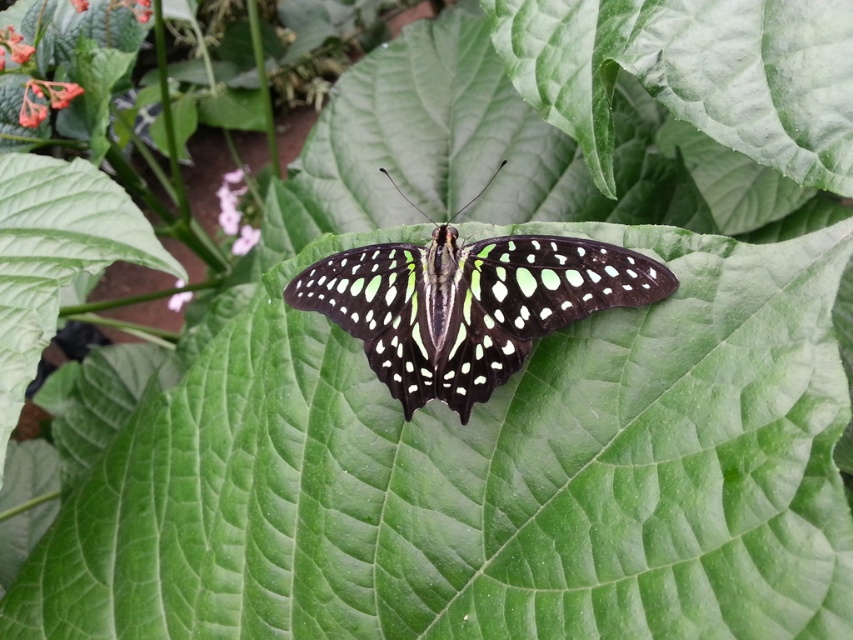
Question: Does green glossy butterfly at center appear on the right side of pink matte flower at center?

Choices:
 (A) no
 (B) yes

Answer: (B)

Question: From the image, what is the correct spatial relationship of pink matte flower at center in relation to pink matte flower at lower left?

Choices:
 (A) above
 (B) below

Answer: (A)

Question: Which point is farther to the camera?

Choices:
 (A) (254, 234)
 (B) (405, 394)
 (C) (257, 209)

Answer: (C)

Question: Which point is farther to the camera?

Choices:
 (A) pyautogui.click(x=178, y=291)
 (B) pyautogui.click(x=238, y=252)
 (C) pyautogui.click(x=368, y=316)
 (D) pyautogui.click(x=256, y=212)

Answer: (D)

Question: Does green glossy butterfly at center have a larger size compared to pink matte flower at center?

Choices:
 (A) yes
 (B) no

Answer: (A)

Question: Which object appears closest to the camera in this image?

Choices:
 (A) matte purple flower at upper left
 (B) green glossy butterfly at center
 (C) pink matte flower at center

Answer: (B)